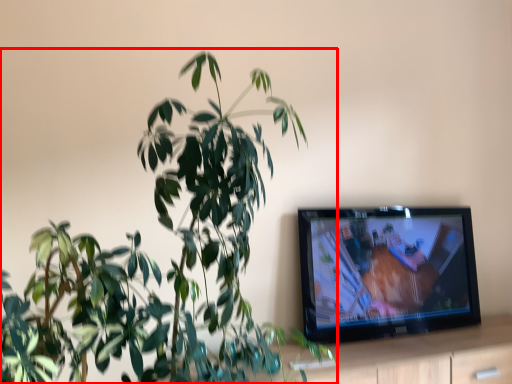
Question: From the image's perspective, what is the correct spatial positioning of houseplant (annotated by the red box) in reference to dresser?

Choices:
 (A) below
 (B) above

Answer: (B)